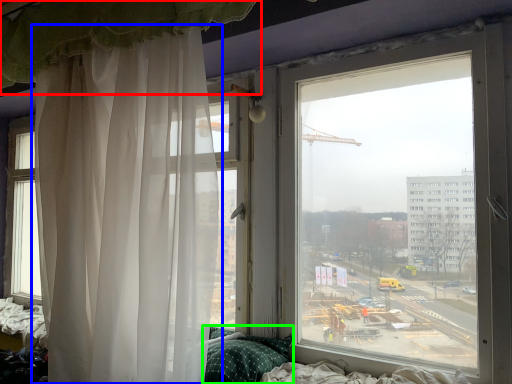
Question: Considering the real-world distances, which object is closest to curtain (highlighted by a red box)? curtain (highlighted by a blue box) or pillow (highlighted by a green box).

Choices:
 (A) curtain
 (B) pillow

Answer: (A)